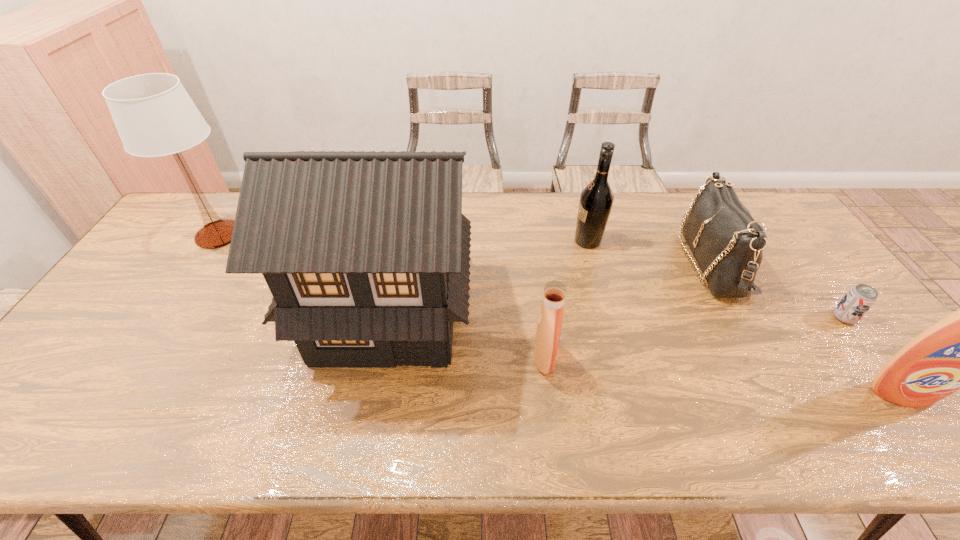
Find the location of a particular element. Image resolution: width=960 pixels, height=540 pixels. free point between the sixth object from right to left and the fourth object from left to right is located at coordinates (488, 276).

The width and height of the screenshot is (960, 540). I want to click on free space between the taller detergent and the wine bottle, so click(746, 316).

Where is `vacant area that lies between the sixth object from right to left and the shorter detergent`? vacant area that lies between the sixth object from right to left and the shorter detergent is located at coordinates pos(467,335).

This screenshot has width=960, height=540. Identify the location of vacant point located between the taller detergent and the dollhouse. (646, 352).

You are a GUI agent. You are given a task and a screenshot of the screen. Output one action in this format:
    pyautogui.click(x=<x>, y=<y>)
    Task: Click on the empty space between the fourth object from left to right and the handbag
    This screenshot has width=960, height=540.
    Given the screenshot: What is the action you would take?
    pyautogui.click(x=649, y=252)

Find the location of a particular element. vacant area between the third object from left to right and the taller detergent is located at coordinates (724, 375).

Locate an element on the screen. free area in between the handbag and the taller detergent is located at coordinates (807, 327).

Locate an element on the screen. Image resolution: width=960 pixels, height=540 pixels. vacant area that lies between the left detergent and the sixth object from right to left is located at coordinates (467, 335).

Locate which object ranks third in proximity to the shorter detergent. Please provide its 2D coordinates. Your answer should be formatted as a tuple, i.e. [(x, y)], where the tuple contains the x and y coordinates of a point satisfying the conditions above.

[(727, 243)]

Identify which object is located as the third nearest to the fourth object from left to right. Please provide its 2D coordinates. Your answer should be formatted as a tuple, i.e. [(x, y)], where the tuple contains the x and y coordinates of a point satisfying the conditions above.

[(549, 326)]